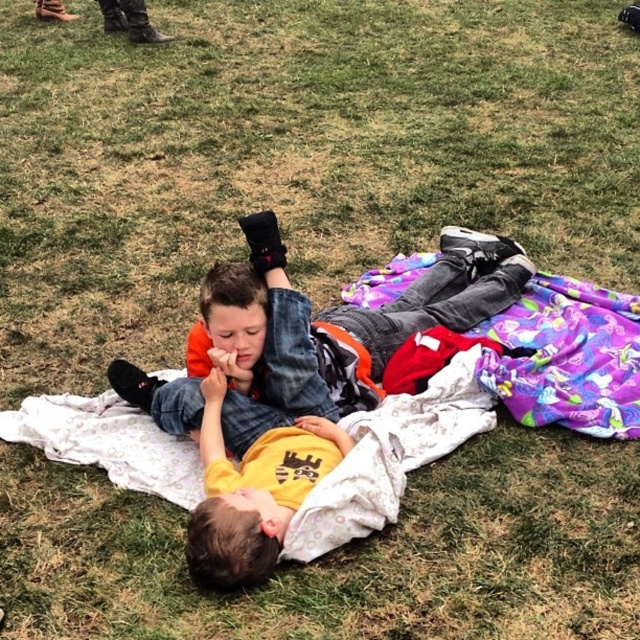
Question: Estimate the real-world distances between objects in this image. Which object is closer to the purple fabric blanket at center?

Choices:
 (A) purple fleece blanket at center
 (B) orange fleece jacket at center

Answer: (A)

Question: Does purple fleece blanket at center come in front of orange fleece jacket at center?

Choices:
 (A) no
 (B) yes

Answer: (B)

Question: Which point is closer to the camera taking this photo?

Choices:
 (A) (442, 397)
 (B) (548, 384)

Answer: (A)

Question: Which object is positioned farthest from the orange fleece jacket at center?

Choices:
 (A) purple fleece blanket at center
 (B) purple fabric blanket at center

Answer: (B)

Question: Does purple fleece blanket at center appear on the right side of orange fleece jacket at center?

Choices:
 (A) no
 (B) yes

Answer: (B)

Question: Observing the image, what is the correct spatial positioning of orange fleece jacket at center in reference to purple fabric blanket at center?

Choices:
 (A) below
 (B) above

Answer: (B)